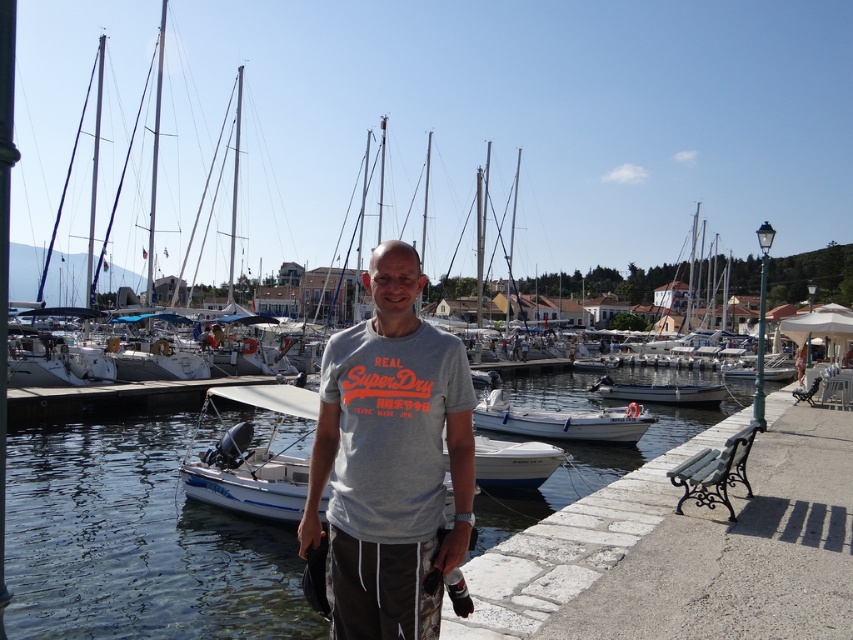
You are standing at the point with coordinates point (x=651, y=388) and want to walk towards the point (x=412, y=563). Which direction should you move?

You should move forward because point (x=412, y=563) is in front of point (x=651, y=388).